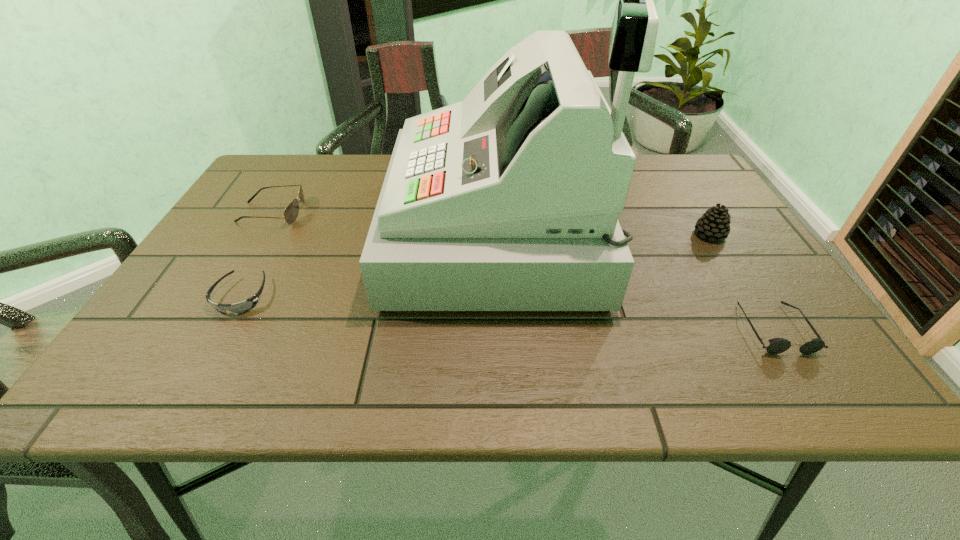
Find the location of a particular element. This screenshot has width=960, height=540. sunglasses identified as the closest to the farthest sunglasses is located at coordinates (244, 306).

Locate which sunglasses ranks in proximity to the second shortest sunglasses. Please provide its 2D coordinates. Your answer should be formatted as a tuple, i.e. [(x, y)], where the tuple contains the x and y coordinates of a point satisfying the conditions above.

[(244, 306)]

Locate an element on the screen. This screenshot has height=540, width=960. blank space that satisfies the following two spatial constraints: 1. at the narrow end of the pinecone; 2. on the lenses of the shortest sunglasses is located at coordinates (748, 296).

Find the location of `free point that satisfies the following two spatial constraints: 1. at the narrow end of the second tallest object; 2. on the lenses of the shortest sunglasses`. free point that satisfies the following two spatial constraints: 1. at the narrow end of the second tallest object; 2. on the lenses of the shortest sunglasses is located at coordinates (748, 296).